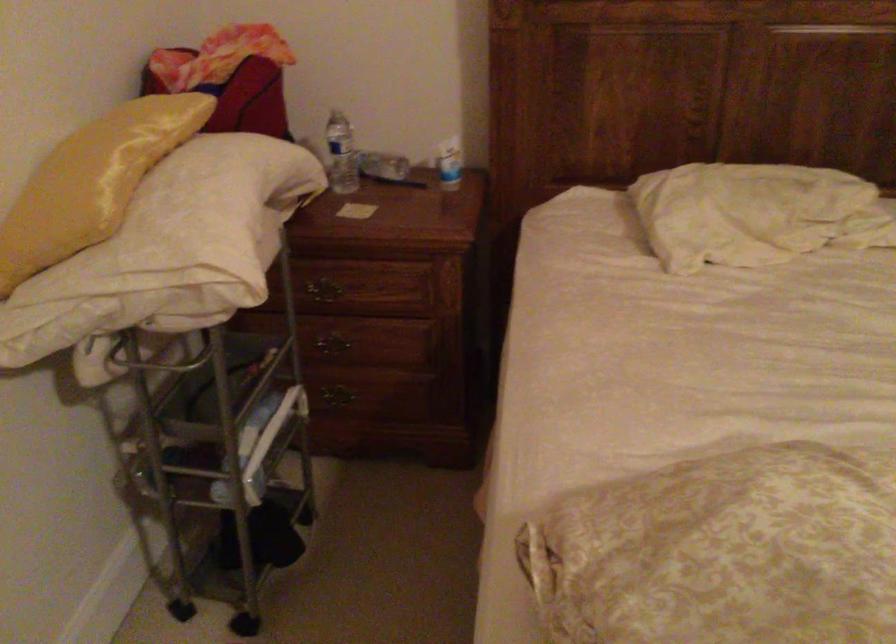
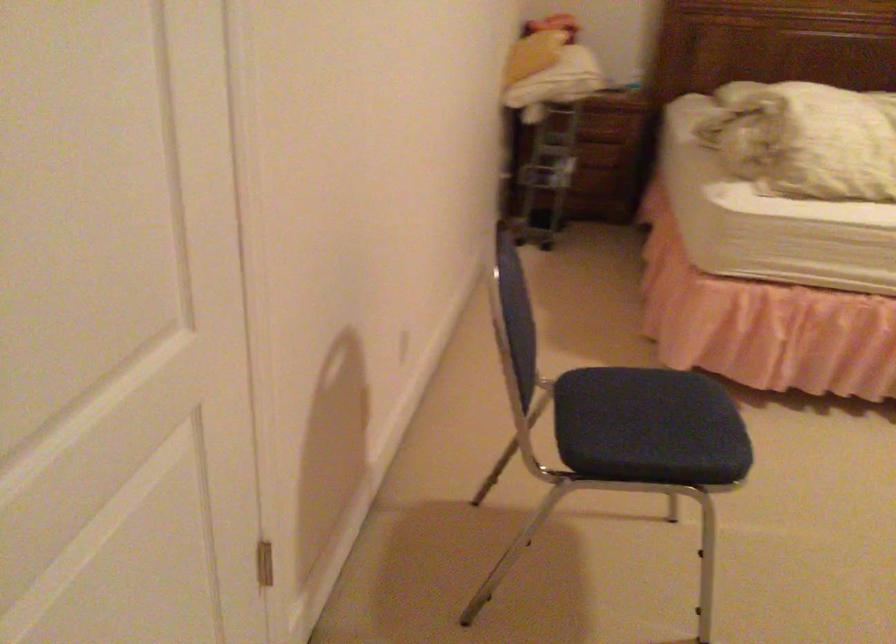
Question: What movement of the cameraman would produce the second image?

Choices:
 (A) Left
 (B) Right
 (C) Forward
 (D) Backward

Answer: (D)